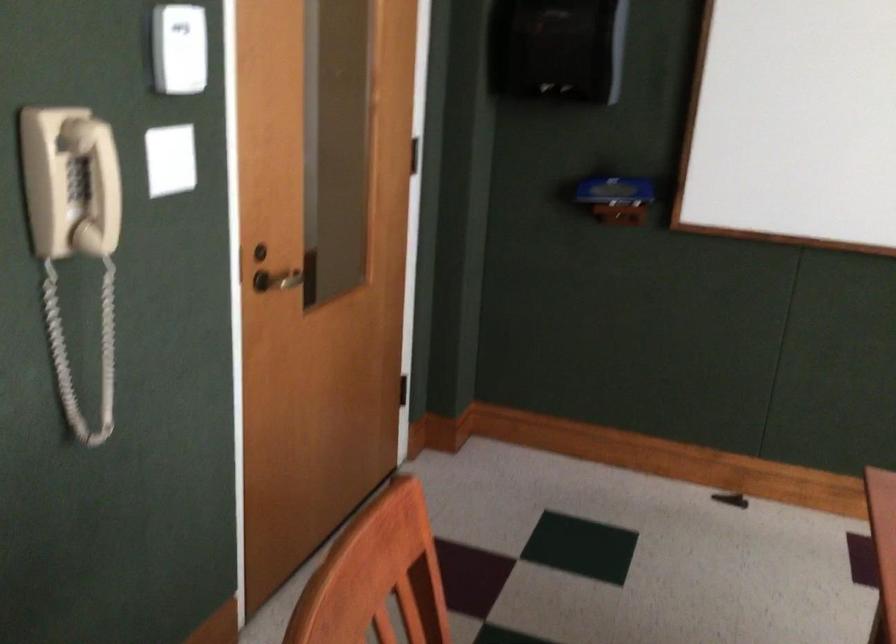
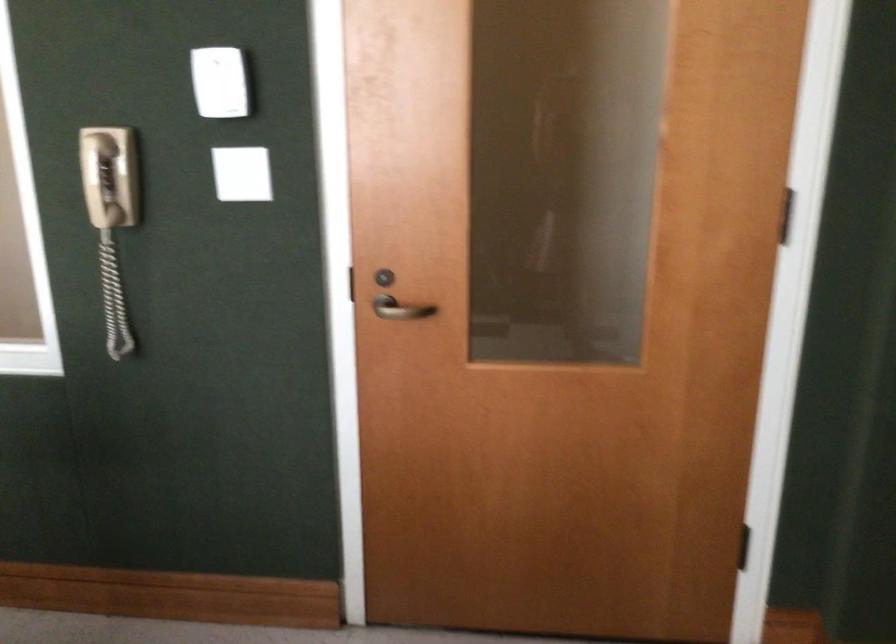
In the second image, find the point that corresponds to (x=116, y=185) in the first image.

(99, 180)